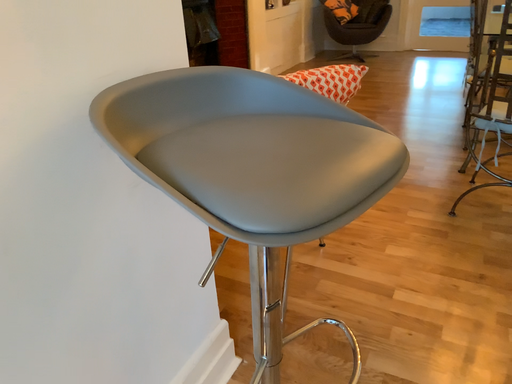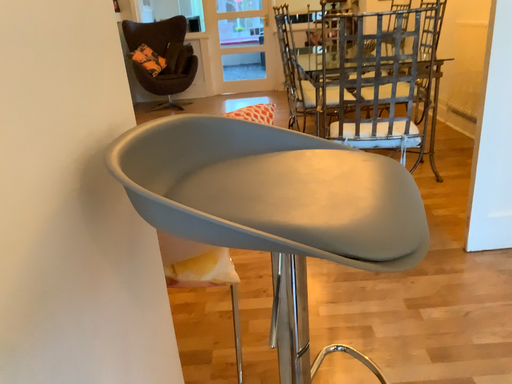
Question: Which way did the camera rotate in the video?

Choices:
 (A) rotated downward
 (B) rotated upward

Answer: (B)